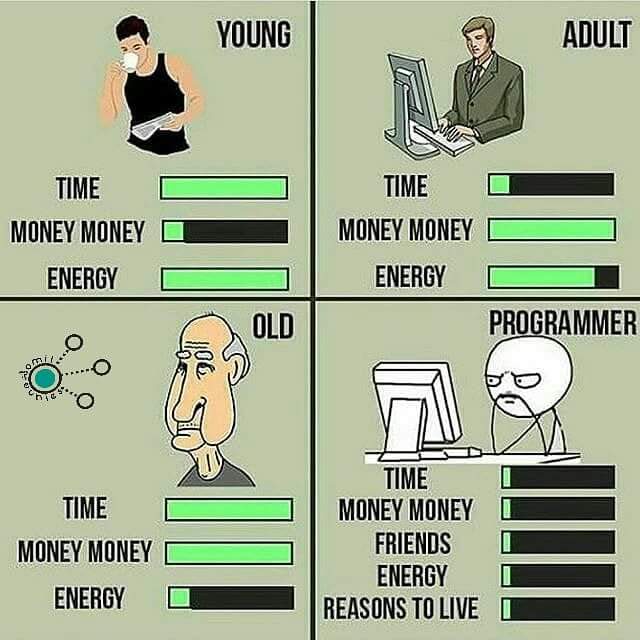
The image size is (640, 640). In order to click on cup in this screenshot , I will do `click(132, 65)`.